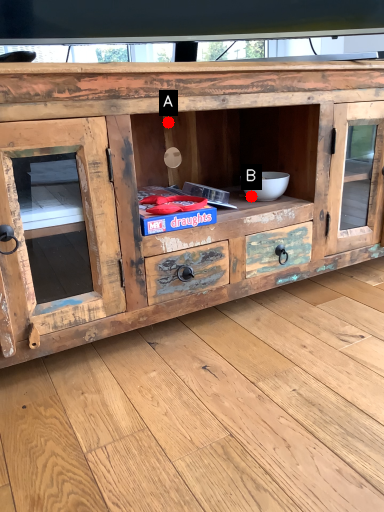
Question: Two points are circled on the image, labeled by A and B beside each circle. Which point is closer to the camera taking this photo?

Choices:
 (A) A is closer
 (B) B is closer

Answer: (B)